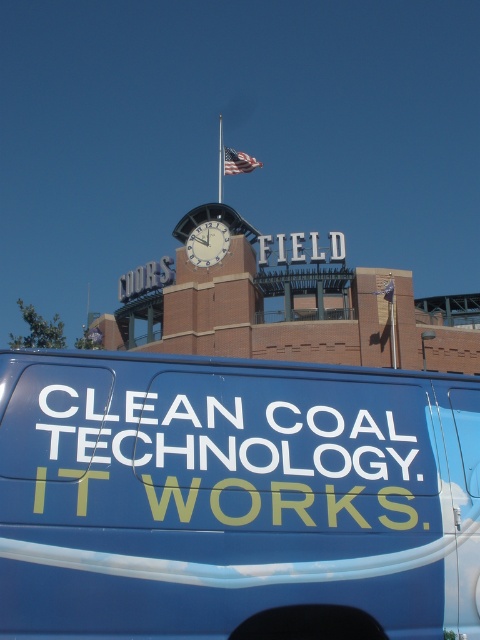
Based on the photo, what is the location of the point with coordinates (236, 497) in the image?

The point with coordinates (236, 497) is located on the blue matte van at lower center.